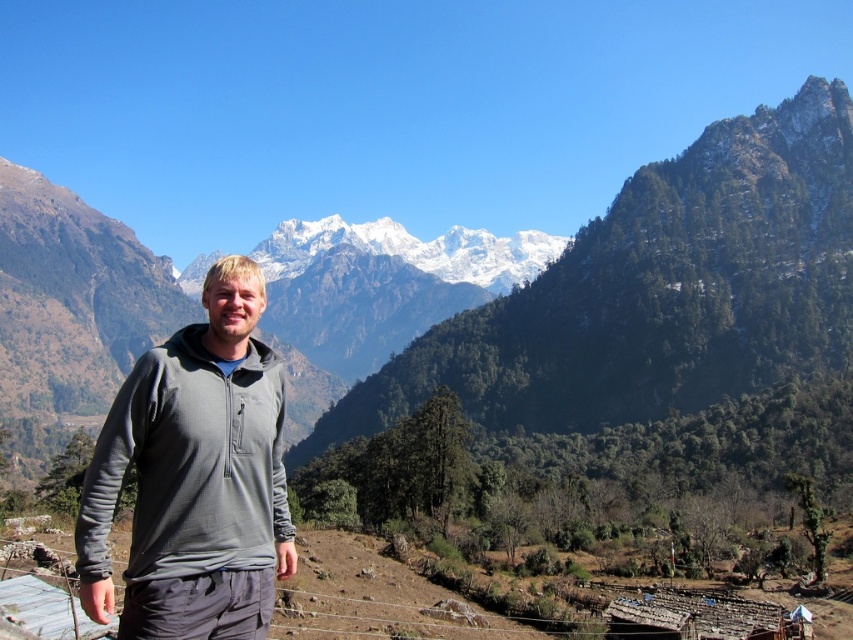
Question: Is snowy granite mountain range at upper center positioned in front of gray fleece jacket at center?

Choices:
 (A) yes
 (B) no

Answer: (B)

Question: Which object appears farthest from the camera in this image?

Choices:
 (A) gray fleece jacket at center
 (B) snowy granite mountain range at upper center

Answer: (B)

Question: Is snowy granite mountain range at upper center wider than gray fleece jacket at center?

Choices:
 (A) yes
 (B) no

Answer: (A)

Question: Among these objects, which one is farthest from the camera?

Choices:
 (A) snowy granite mountain range at upper center
 (B) gray fleece jacket at center

Answer: (A)

Question: Can you confirm if snowy granite mountain range at upper center is positioned above gray fleece jacket at center?

Choices:
 (A) no
 (B) yes

Answer: (B)

Question: Which point is closer to the camera taking this photo?

Choices:
 (A) (224, 316)
 (B) (373, 333)

Answer: (A)